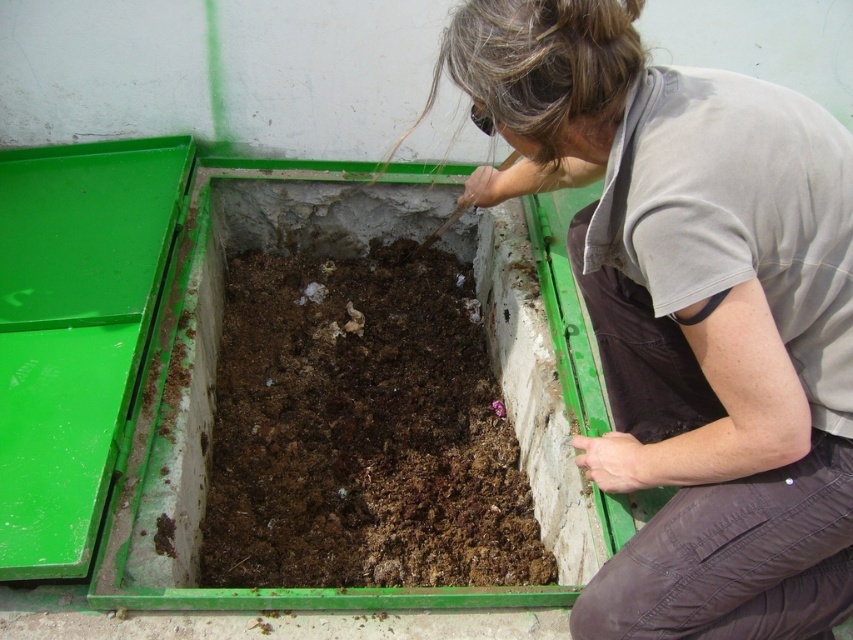
Question: Can you confirm if gray fabric shirt at center is positioned above brown soil at center?

Choices:
 (A) no
 (B) yes

Answer: (B)

Question: Is gray fabric shirt at center to the right of brown soil at center from the viewer's perspective?

Choices:
 (A) no
 (B) yes

Answer: (B)

Question: Considering the relative positions of gray fabric shirt at center and brown soil at center in the image provided, where is gray fabric shirt at center located with respect to brown soil at center?

Choices:
 (A) right
 (B) left

Answer: (A)

Question: Which of the following is the farthest from the observer?

Choices:
 (A) gray fabric shirt at center
 (B) brown soil at center

Answer: (B)

Question: Among these points, which one is farthest from the camera?

Choices:
 (A) (445, 496)
 (B) (720, 376)

Answer: (A)